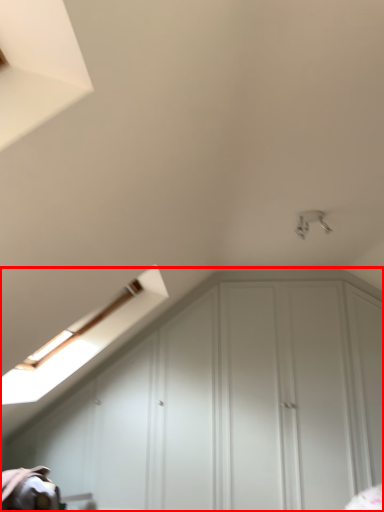
Question: Observing the image, what is the correct spatial positioning of dresser (annotated by the red box) in reference to light fixture?

Choices:
 (A) right
 (B) left

Answer: (B)